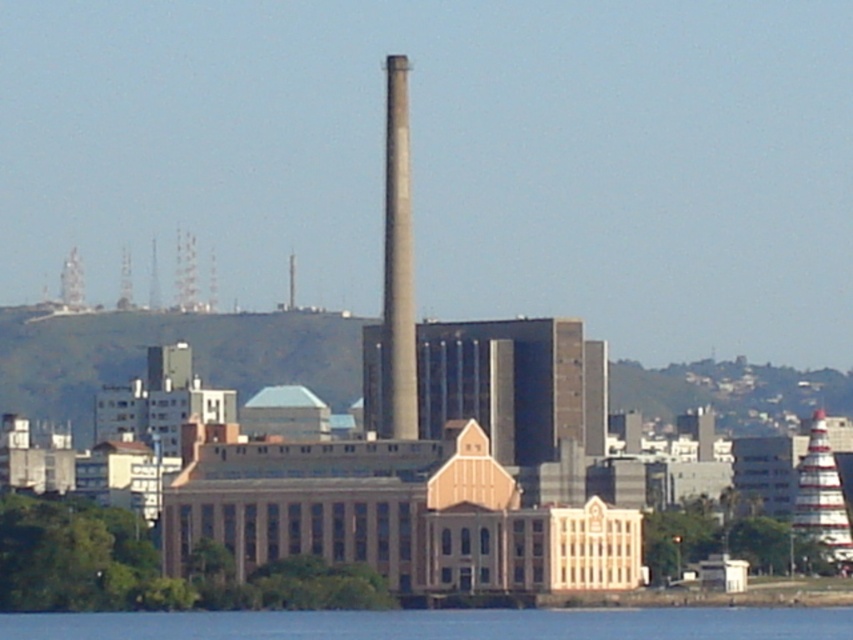
You are standing at the base of the smokestack in the industrial landscape. You see a point marked at coordinates (442, 625). What does this point indicate?

The point at coordinates (442, 625) marks the location of blue water at lower center in the image.

You are a drone operator who needs to fly a drone from the gray concrete tower at center to the white striped tower at right. Considering the size difference between them, which tower will require more careful navigation due to its size?

The gray concrete tower at center has a larger size compared to the white striped tower at right, so it will require more careful navigation due to its larger size.

You are standing at the base of the white striped tower at right and want to get to the blue water at lower center. Which direction should you walk?

The blue water at lower center is located below the white striped tower at right, so you should walk downward or towards the lower part of the scene to reach it.